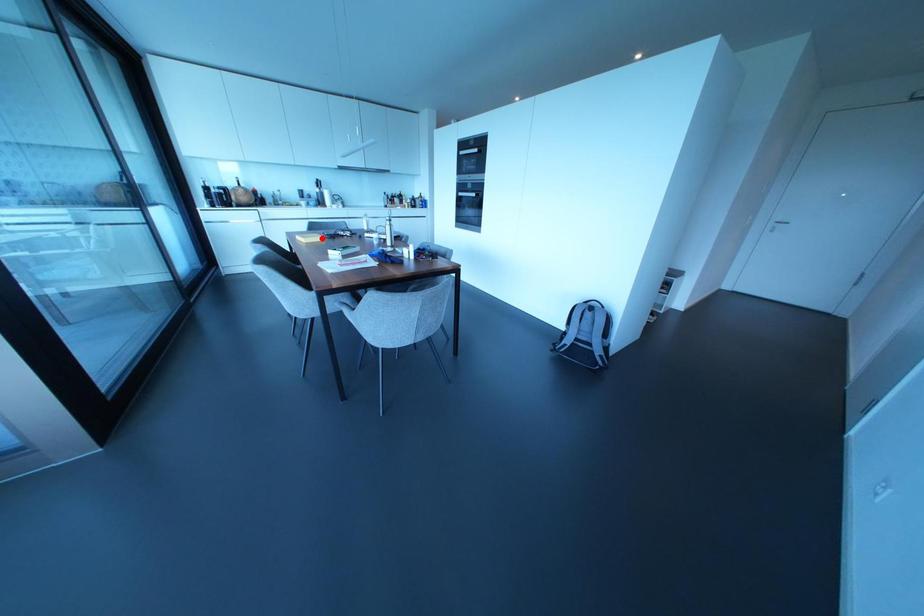
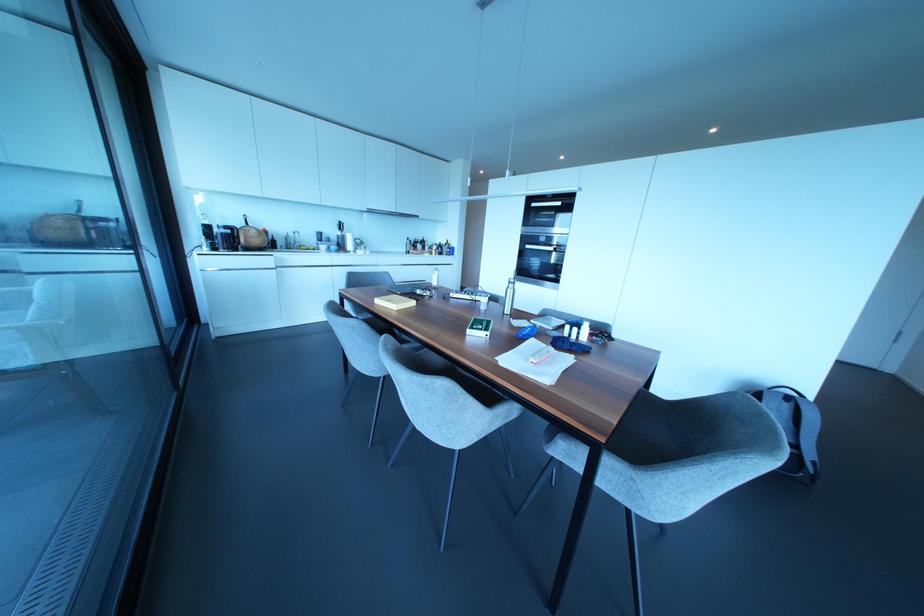
The point at the highlighted location is marked in the first image. Where is the corresponding point in the second image?

(411, 302)